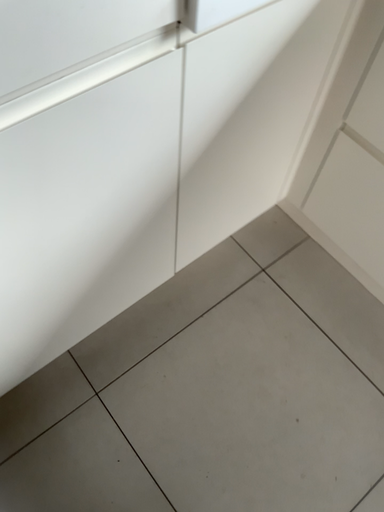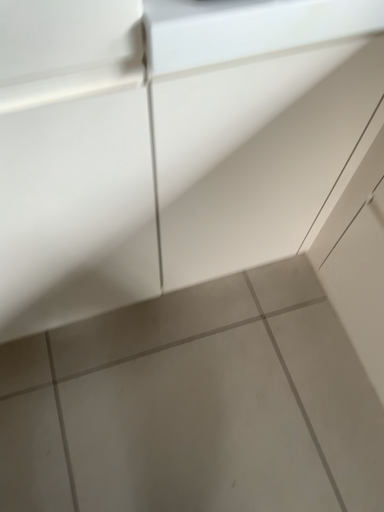
Question: How did the camera likely rotate when shooting the video?

Choices:
 (A) rotated left
 (B) rotated right

Answer: (A)